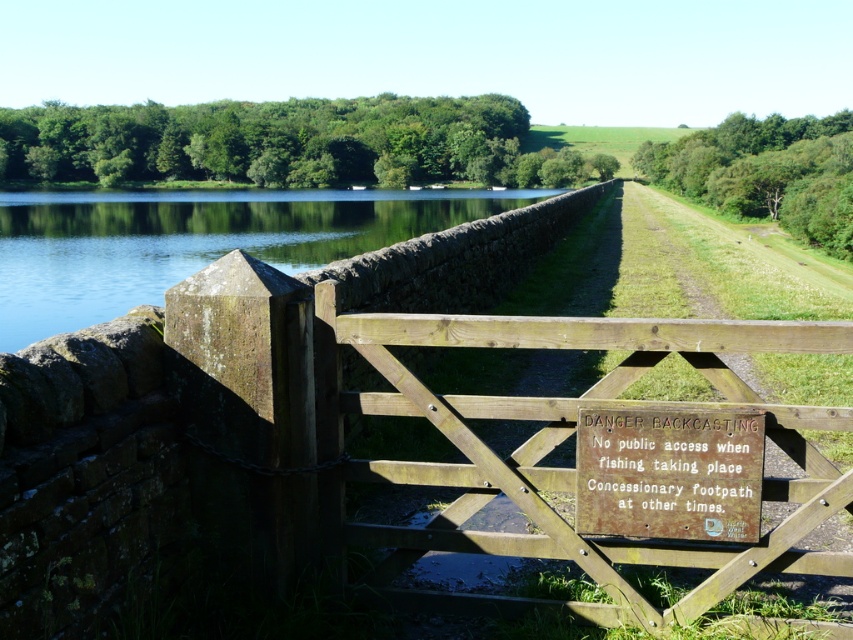
What is the spatial relationship between the green stone wall at upper left and the rusty wooden sign at center?

The green stone wall at upper left is positioned to the left of the rusty wooden sign at center.

You are standing at the wooden gate with the metal crossbar and want to reach the point marked as point (125, 301). Which direction should you go relative to the point (672, 493)?

Since point (125, 301) is behind point (672, 493), you should go behind point (672, 493) to reach point (125, 301).